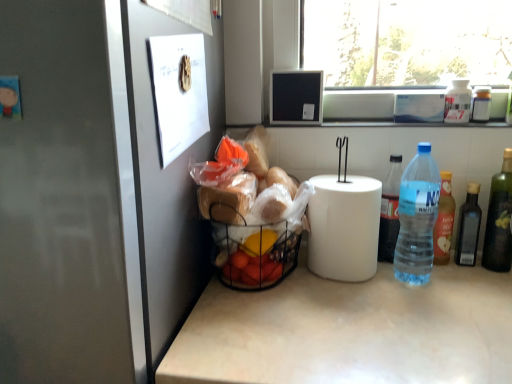
Question: Do you think blue plastic bottle at right, which appears as the seventh bottle when viewed from the right, is within dark glass bottle at right, placed as the 5th bottle when sorted from left to right, or outside of it?

Choices:
 (A) inside
 (B) outside

Answer: (B)

Question: From a real-world perspective, is blue plastic bottle at right, which appears as the seventh bottle when viewed from the right, positioned above or below dark glass bottle at right, positioned as the 3th bottle in right-to-left order?

Choices:
 (A) above
 (B) below

Answer: (A)

Question: Based on their relative distances, which object is nearer to the white plastic bottle at upper right, acting as the fourth bottle starting from the right?

Choices:
 (A) translucent plastic bottle at right, which ranks as the 3th bottle in left-to-right order
 (B) black wire basket at lower left
 (C) green glass bottle at right, which ranks as the seventh bottle in left-to-right order
 (D) dark glass bottle at right, positioned as the 3th bottle in right-to-left order
 (E) black matte frame at upper center

Answer: (A)

Question: Estimate the real-world distances between objects in this image. Which object is farther from the blue plastic bottle at right, which appears as the seventh bottle when viewed from the right?

Choices:
 (A) white plastic bottle at upper right, acting as the fourth bottle starting from the right
 (B) translucent plastic bottle at right, which ranks as the 3th bottle in left-to-right order
 (C) black matte frame at upper center
 (D) satin silver fridge at left
 (E) green glass bottle at right, which ranks as the seventh bottle in left-to-right order

Answer: (D)